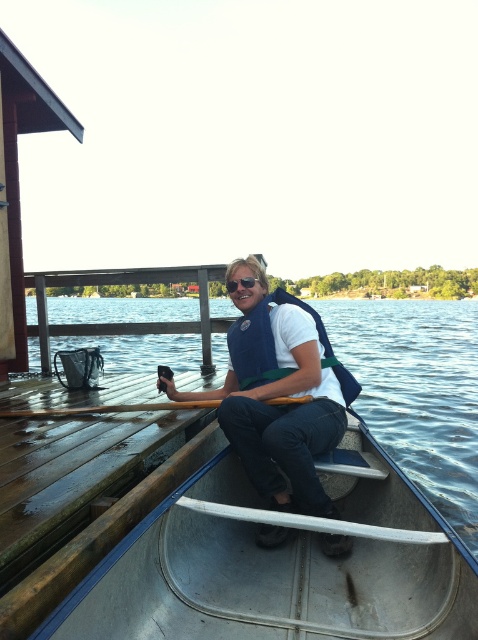
Question: Which object is positioned closest to the white matte life vest at center?

Choices:
 (A) clear water at boat center
 (B) navy blue fabric life jacket at center
 (C) sunglasses at center
 (D) wooden at left

Answer: (B)

Question: Can you confirm if clear water at boat center is smaller than wooden at left?

Choices:
 (A) no
 (B) yes

Answer: (A)

Question: Is clear water at boat center to the left of sunglasses at center from the viewer's perspective?

Choices:
 (A) yes
 (B) no

Answer: (B)

Question: Which point is closer to the camera?

Choices:
 (A) (231, 284)
 (B) (394, 352)
 (C) (349, 397)

Answer: (C)

Question: In this image, where is clear water at boat center located relative to white matte life vest at center?

Choices:
 (A) above
 (B) below

Answer: (A)

Question: Which point is farther to the camera?

Choices:
 (A) (250, 284)
 (B) (77, 298)
 (C) (284, 346)

Answer: (B)